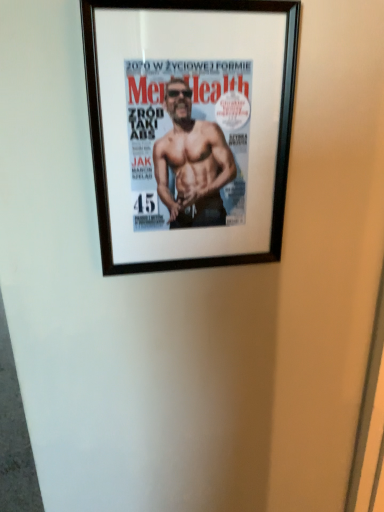
What do you see at coordinates (189, 129) in the screenshot? I see `black wood picture frame at upper center` at bounding box center [189, 129].

This screenshot has height=512, width=384. I want to click on black wood picture frame at upper center, so click(189, 129).

The width and height of the screenshot is (384, 512). I want to click on black wood picture frame at upper center, so click(189, 129).